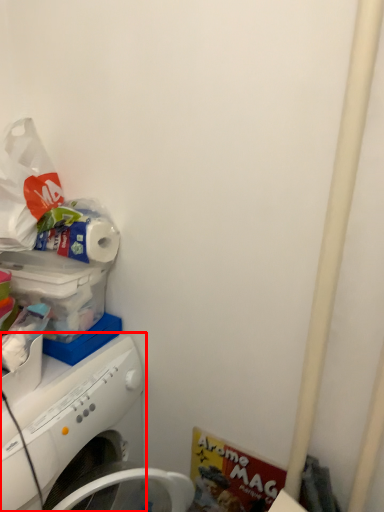
Question: Considering the relative positions of washing machine (annotated by the red box) and toilet paper in the image provided, where is washing machine (annotated by the red box) located with respect to the staircase?

Choices:
 (A) left
 (B) right

Answer: (A)